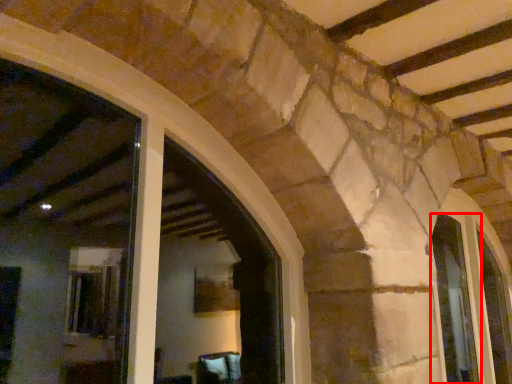
Question: From the image's perspective, what is the correct spatial relationship of window (annotated by the red box) in relation to window?

Choices:
 (A) below
 (B) above

Answer: (B)